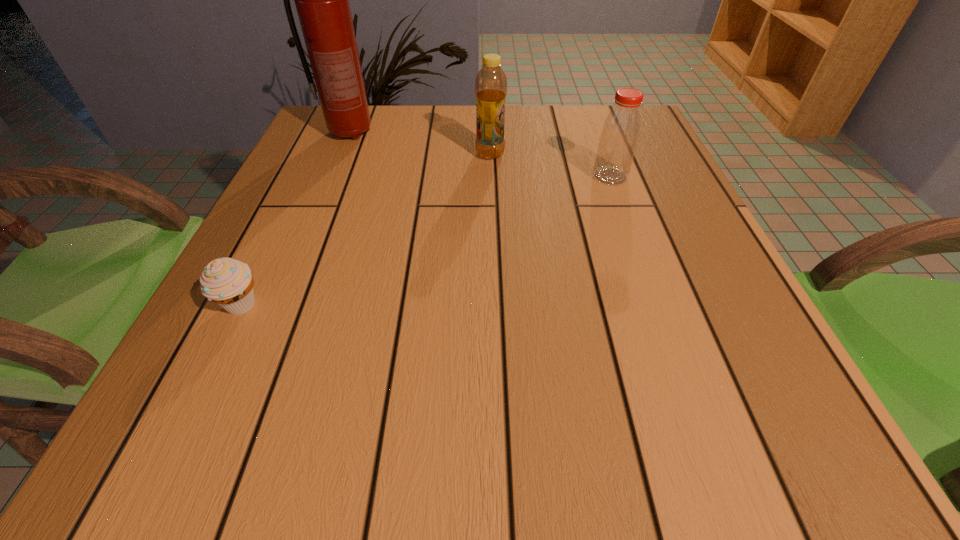
This screenshot has height=540, width=960. Find the location of `free spot between the fire extinguisher and the taller bottle`. free spot between the fire extinguisher and the taller bottle is located at coordinates (420, 144).

Where is `vacant area between the right bottle and the muffin`? vacant area between the right bottle and the muffin is located at coordinates (425, 241).

Locate an element on the screen. This screenshot has height=540, width=960. free area in between the nearest object and the third nearest object is located at coordinates 366,230.

Point out which object is positioned as the nearest to the nearer bottle. Please provide its 2D coordinates. Your answer should be formatted as a tuple, i.e. [(x, y)], where the tuple contains the x and y coordinates of a point satisfying the conditions above.

[(491, 83)]

The width and height of the screenshot is (960, 540). Identify the location of object that is the third closest one to the third nearest object. (228, 282).

The height and width of the screenshot is (540, 960). In order to click on free space that satisfies the following two spatial constraints: 1. on the handle side the fire extinguisher; 2. on the back side of the right bottle in this screenshot , I will do `click(331, 176)`.

You are a GUI agent. You are given a task and a screenshot of the screen. Output one action in this format:
    pyautogui.click(x=<x>, y=<y>)
    Task: Click on the free space in the image that satisfies the following two spatial constraints: 1. on the back side of the second nearest object; 2. on the handle side the tallest object
    
    Given the screenshot: What is the action you would take?
    pyautogui.click(x=594, y=133)

Identify the location of free location that satisfies the following two spatial constraints: 1. on the handle side the farther bottle; 2. on the left side of the farthest object. (341, 154).

This screenshot has height=540, width=960. I want to click on free space that satisfies the following two spatial constraints: 1. on the handle side the farthest object; 2. on the back side of the farther bottle, so click(x=341, y=154).

I want to click on vacant space that satisfies the following two spatial constraints: 1. on the handle side the fire extinguisher; 2. on the back side of the rightmost object, so click(331, 176).